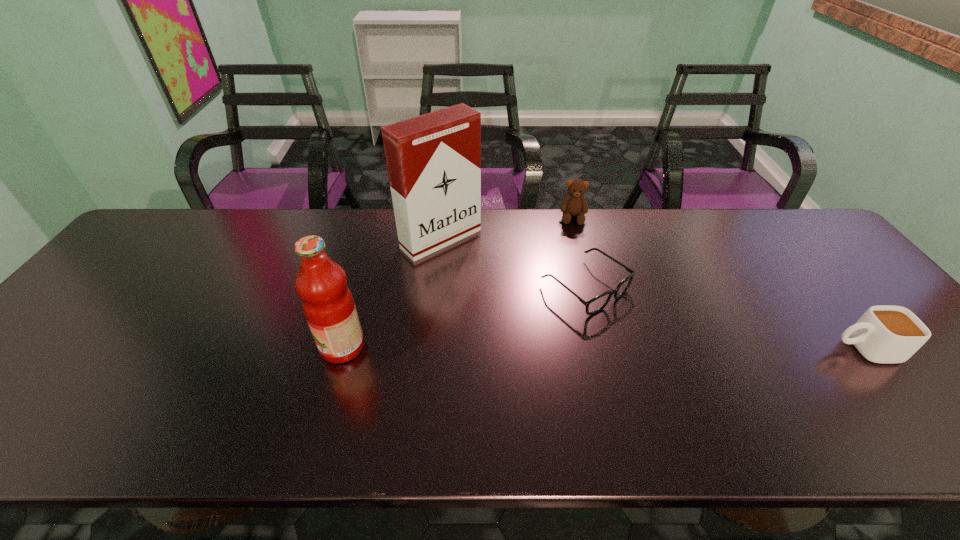
Where is `free space located on the face of the third shortest object`? The image size is (960, 540). free space located on the face of the third shortest object is located at coordinates (574, 256).

Image resolution: width=960 pixels, height=540 pixels. Identify the location of free space located 0.380m on the face of the third shortest object. (575, 313).

Where is `vacant space situated 0.200m on the face of the third shortest object`? vacant space situated 0.200m on the face of the third shortest object is located at coordinates (574, 267).

Where is `cigarette_case present at the far edge`? The height and width of the screenshot is (540, 960). cigarette_case present at the far edge is located at coordinates (434, 160).

Identify the location of teddy bear present at the far edge. (575, 204).

Where is `object present at the right edge`? The height and width of the screenshot is (540, 960). object present at the right edge is located at coordinates (884, 334).

I want to click on vacant space at the far edge of the desktop, so click(x=246, y=255).

In the image, there is a desktop. Identify the location of vacant area at the near edge. The image size is (960, 540). (756, 388).

In the image, there is a desktop. Where is `vacant space at the right edge`? vacant space at the right edge is located at coordinates (818, 293).

Image resolution: width=960 pixels, height=540 pixels. Identify the location of vacant space at the near right corner of the desktop. (897, 396).